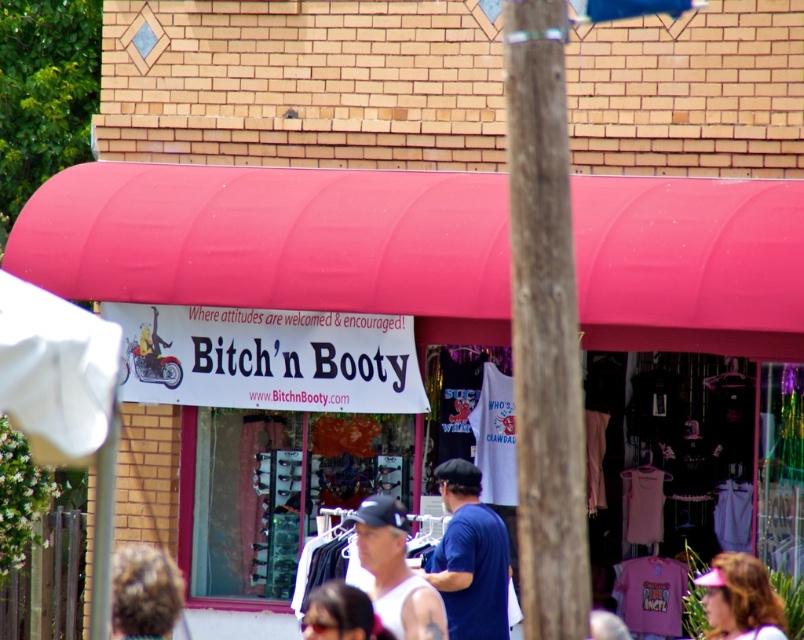
Question: Based on their relative distances, which object is nearer to the blue cotton shirt at center?

Choices:
 (A) white tank top at center
 (B) blonde hair at lower left

Answer: (A)

Question: Which object is farther from the camera taking this photo?

Choices:
 (A) blonde hair at lower left
 (B) blue cotton shirt at center
 (C) pink fabric visor at lower right
 (D) white tank top at center

Answer: (B)

Question: Estimate the real-world distances between objects in this image. Which object is closer to the pink fabric visor at lower right?

Choices:
 (A) blonde hair at lower left
 (B) blue cotton shirt at center

Answer: (B)

Question: Does white tank top at center appear over blonde hair at lower left?

Choices:
 (A) yes
 (B) no

Answer: (A)

Question: Does matte pink awning at center have a larger size compared to blonde hair at lower left?

Choices:
 (A) yes
 (B) no

Answer: (A)

Question: Can you confirm if blue cotton shirt at center is bigger than blonde hair at lower left?

Choices:
 (A) no
 (B) yes

Answer: (B)